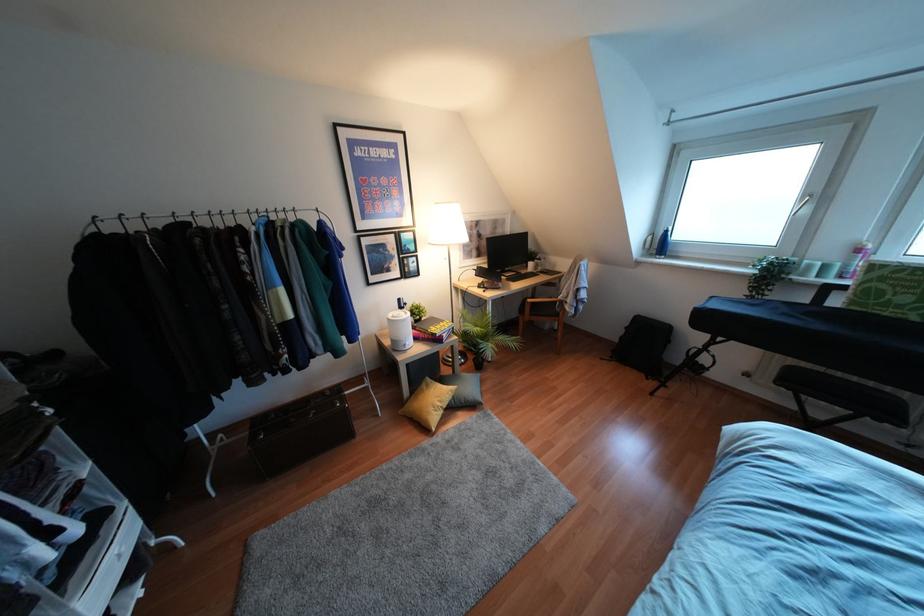
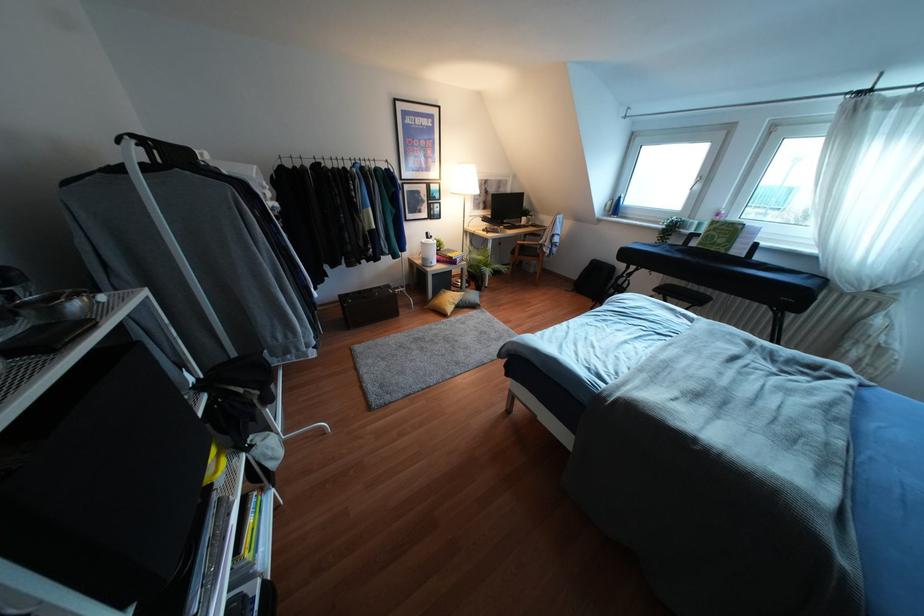
In the second image, find the point that corresponds to [398,299] in the first image.

(427, 233)